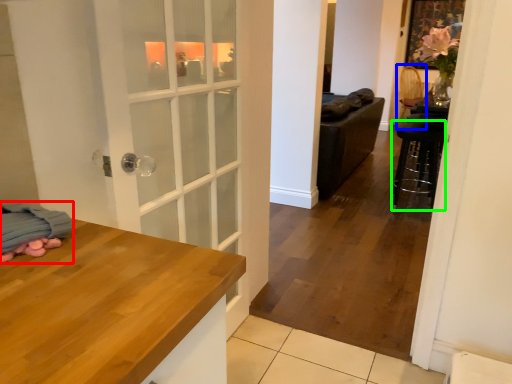
Question: Considering the real-world distances, which object is farthest from blanket (highlighted by a red box)? armchair (highlighted by a blue box) or bar stool (highlighted by a green box)?

Choices:
 (A) armchair
 (B) bar stool

Answer: (A)